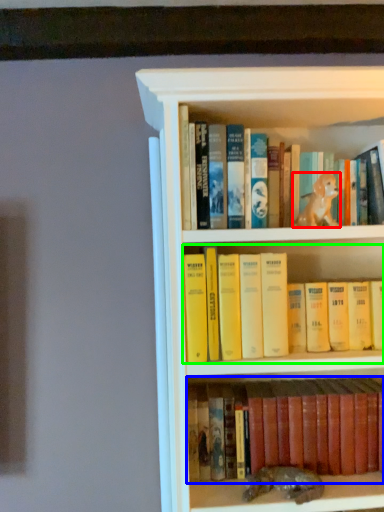
Question: Estimate the real-world distances between objects in this image. Which object is farther from animal (highlighted by a red box), book (highlighted by a blue box) or book (highlighted by a green box)?

Choices:
 (A) book
 (B) book

Answer: (A)